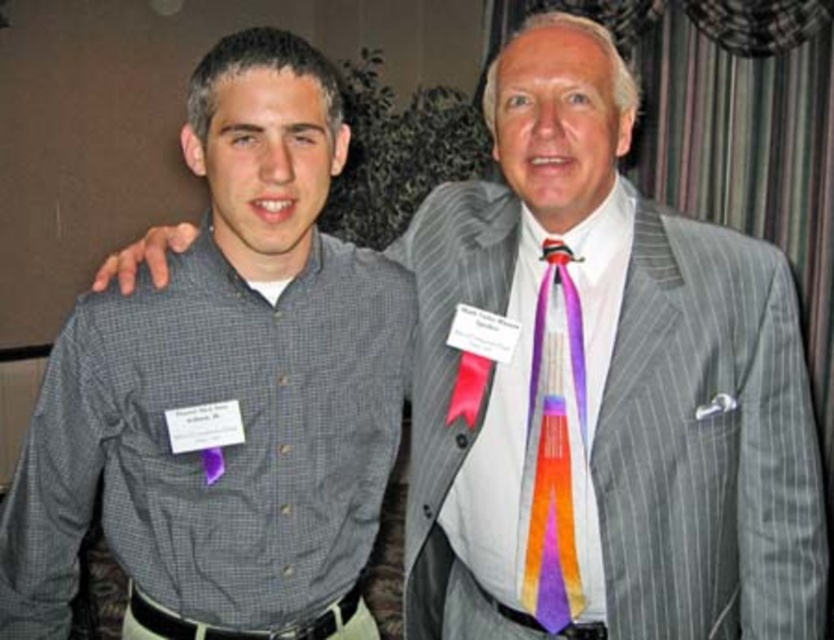
Question: Which point is farther from the camera taking this photo?

Choices:
 (A) (561, 422)
 (B) (93, 365)

Answer: (A)

Question: Does gray checkered shirt at left appear on the left side of multicolored silk tie at center?

Choices:
 (A) yes
 (B) no

Answer: (A)

Question: Is gray pinstripe suit at right to the left of multicolored silk tie at center from the viewer's perspective?

Choices:
 (A) no
 (B) yes

Answer: (A)

Question: Which point is farther from the camera taking this photo?

Choices:
 (A) (543, 560)
 (B) (777, 330)

Answer: (A)

Question: Which of these objects is positioned farthest from the multicolored silk tie at center?

Choices:
 (A) gray pinstripe suit at right
 (B) gray checkered shirt at left

Answer: (B)

Question: Can you confirm if gray pinstripe suit at right is bigger than multicolored silk tie at center?

Choices:
 (A) yes
 (B) no

Answer: (A)